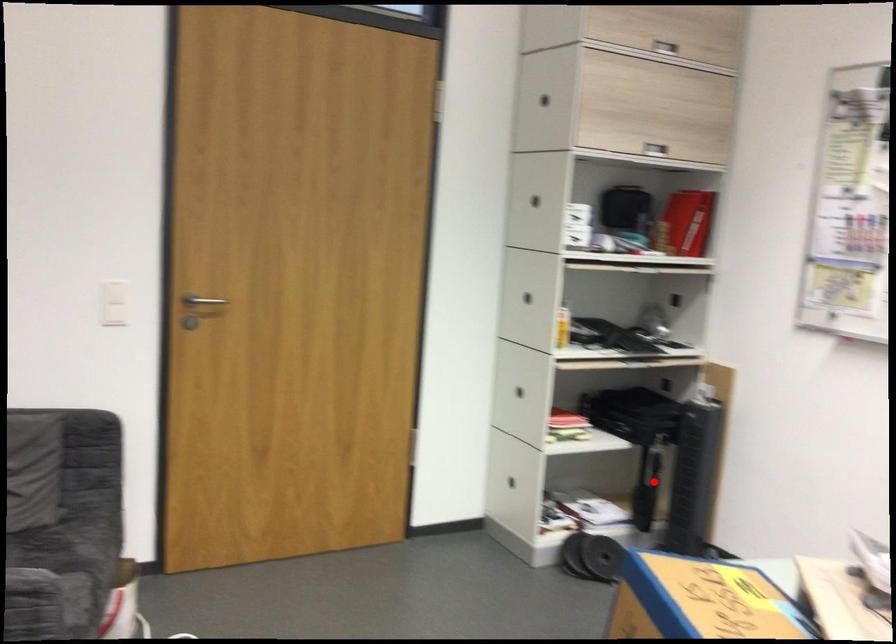
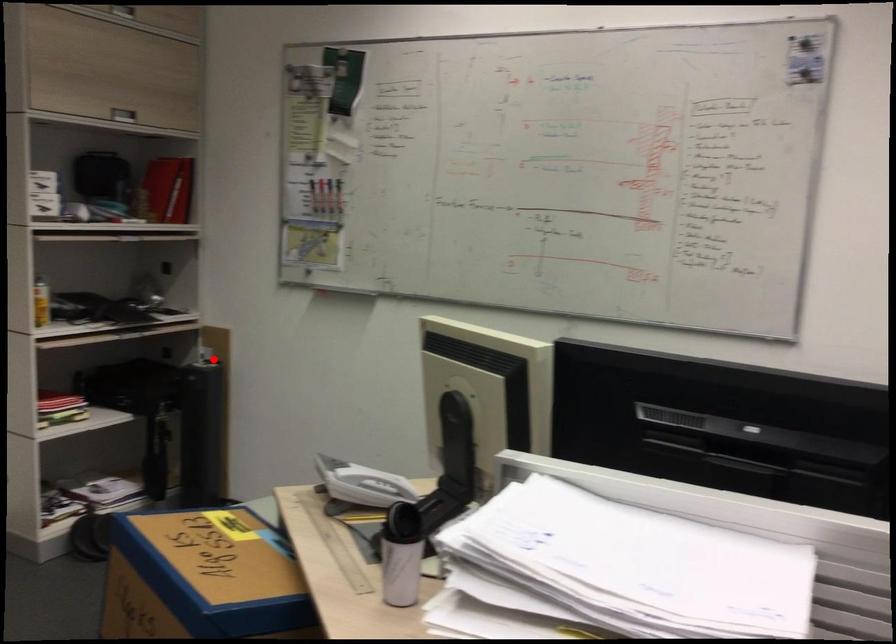
I am providing you with two images of the same scene from different viewpoints. A red point is marked on the first image and another point is marked on the second image. Does the point marked in image1 correspond to the same location as the one in image2?

No